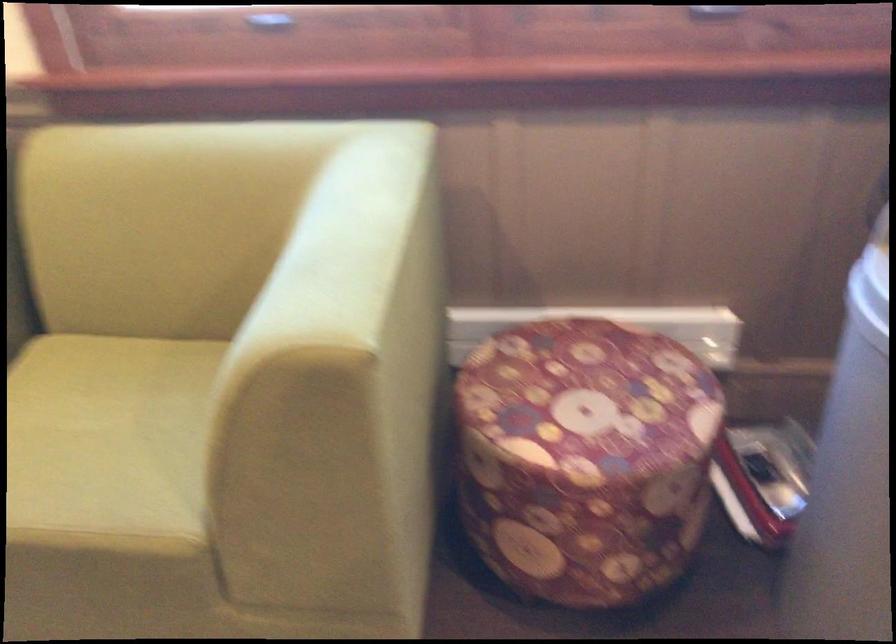
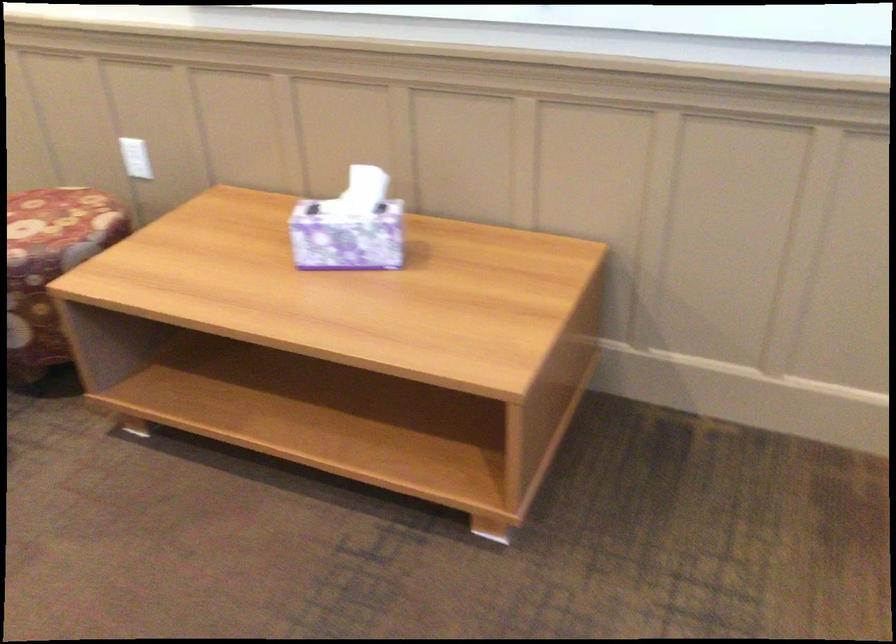
The first image is from the beginning of the video and the second image is from the end. How did the camera likely rotate when shooting the video?

The camera's rotation is toward left-down.